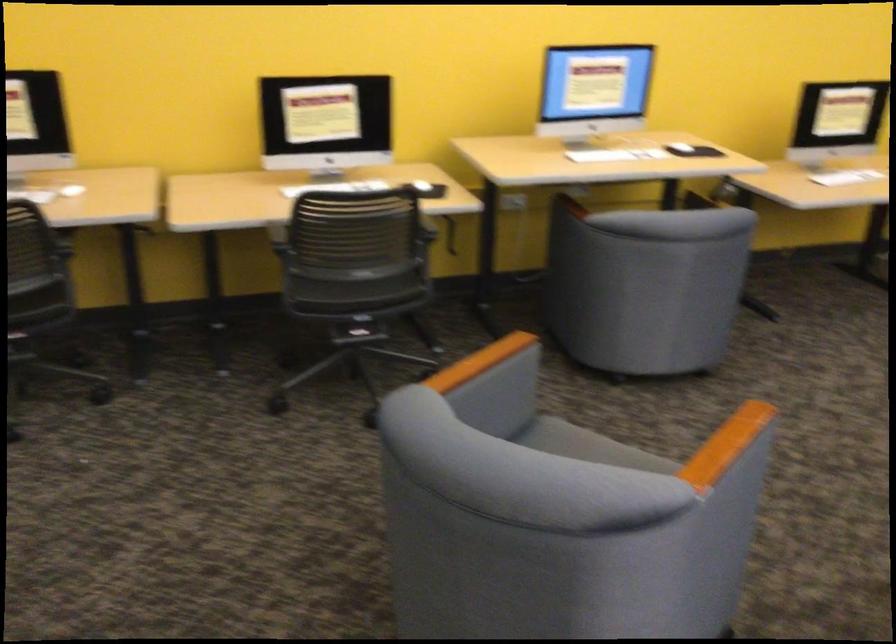
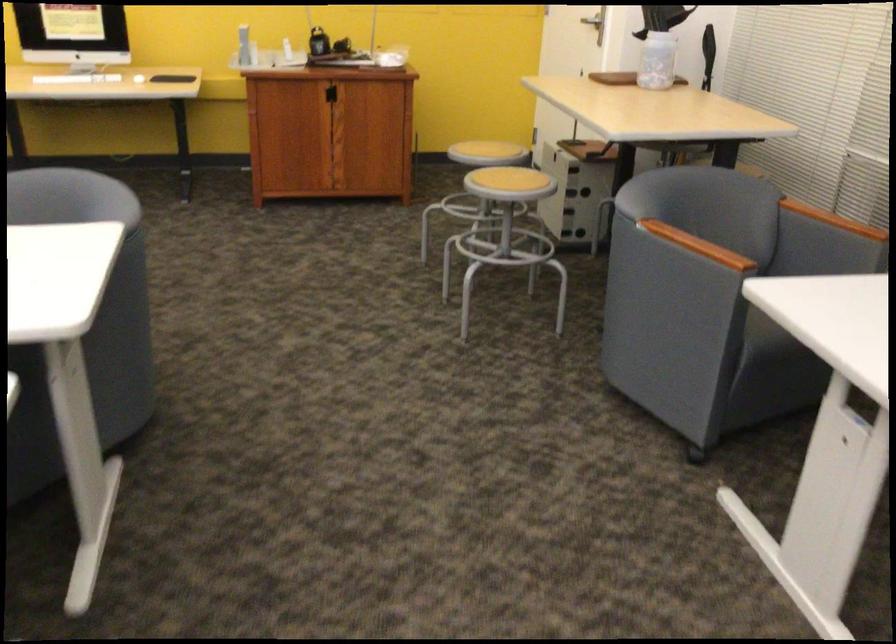
Question: What movement of the cameraman would produce the second image?

Choices:
 (A) Left
 (B) Right
 (C) Forward
 (D) Backward

Answer: (B)